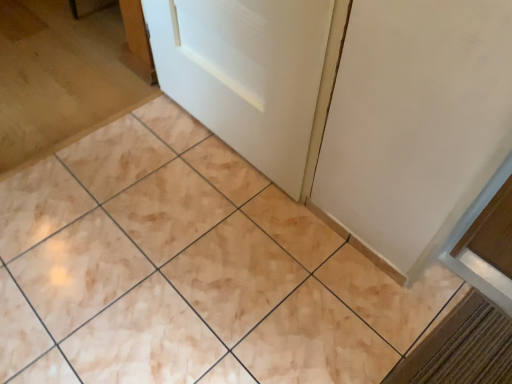
At what (x,y) coordinates should I click in order to perform the action: click on free spot to the left of white glossy door at upper center. Please return your answer as a coordinate pair (x, y). Looking at the image, I should click on (133, 152).